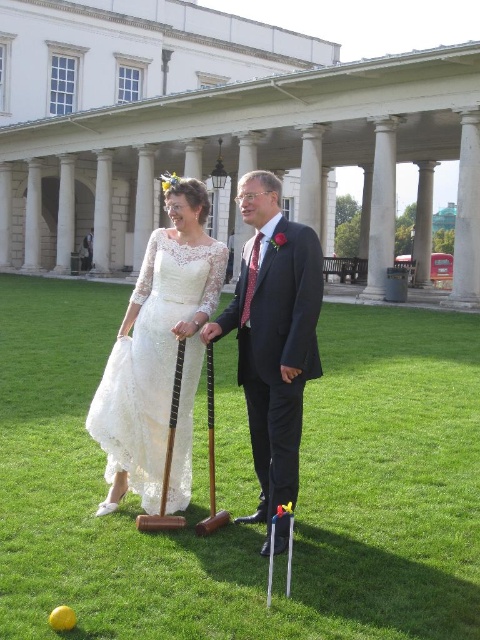
You are planning to place a small bench in the image. The bench requires a space wider than the lace dress at center. Can the green grass at center provide enough space for the bench?

The green grass at center might be wider than the lace dress at center, so there is a possibility that the grass area can accommodate the bench. However, since the exact width difference isn not specified, it is recommended to measure the space before placing the bench.

You are a photographer at a wedding event and need to position two guests for a photo. The guests are wearing a matte black suit at center and a lace dress at center. Based on their positions, which guest is standing to the right of the other?

The matte black suit at center is to the right of the lace dress at center, so the guest in the matte black suit at center is standing to the right of the lace dress at center.

Looking at this image, based on the coordinates provided, what is the color of the area at point (250, 525) in the image?

The area at point (250, 525) is green grass at center.